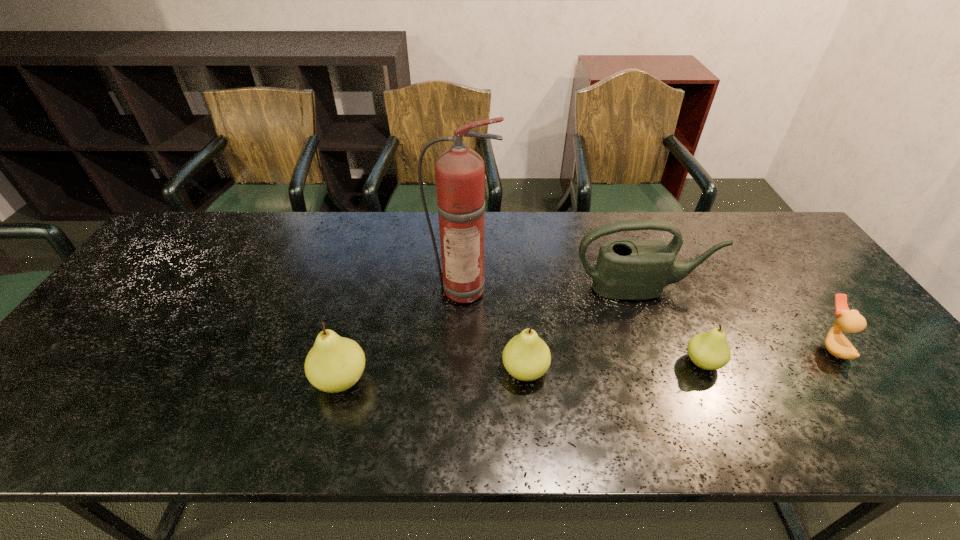
You are a GUI agent. You are given a task and a screenshot of the screen. Output one action in this format:
    pyautogui.click(x=<x>, y=<y>)
    Task: Click on the blank space at the far right corner of the desktop
    
    Given the screenshot: What is the action you would take?
    pyautogui.click(x=779, y=232)

Find the location of a particular element. The image size is (960, 540). free space between the shortest pear and the tallest object is located at coordinates (584, 325).

Locate an element on the screen. The width and height of the screenshot is (960, 540). free area in between the watering can and the fire extinguisher is located at coordinates (552, 288).

Locate an element on the screen. This screenshot has width=960, height=540. blank region between the shortest pear and the fourth object from right to left is located at coordinates (613, 367).

I want to click on free spot between the second object from left to right and the leftmost pear, so coord(402,334).

Locate an element on the screen. vacant space that's between the second tallest object and the shortest pear is located at coordinates (672, 326).

You are a GUI agent. You are given a task and a screenshot of the screen. Output one action in this format:
    pyautogui.click(x=<x>, y=<y>)
    Task: Click on the free space between the third shortest object and the rightmost pear
    Image resolution: width=960 pixels, height=540 pixels.
    Given the screenshot: What is the action you would take?
    click(613, 367)

This screenshot has width=960, height=540. What are the coordinates of `vacant region between the duck and the fifth object from right to left` in the screenshot? It's located at 647,318.

Image resolution: width=960 pixels, height=540 pixels. Identify the location of vacant space in between the leftmost pear and the fire extinguisher. (402, 334).

The height and width of the screenshot is (540, 960). I want to click on vacant point located between the duck and the leftmost object, so click(587, 363).